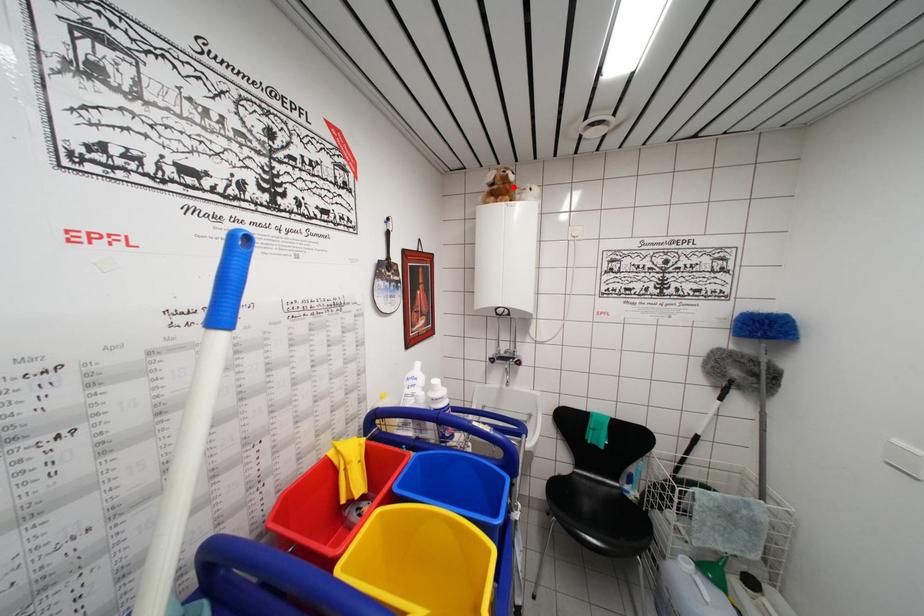
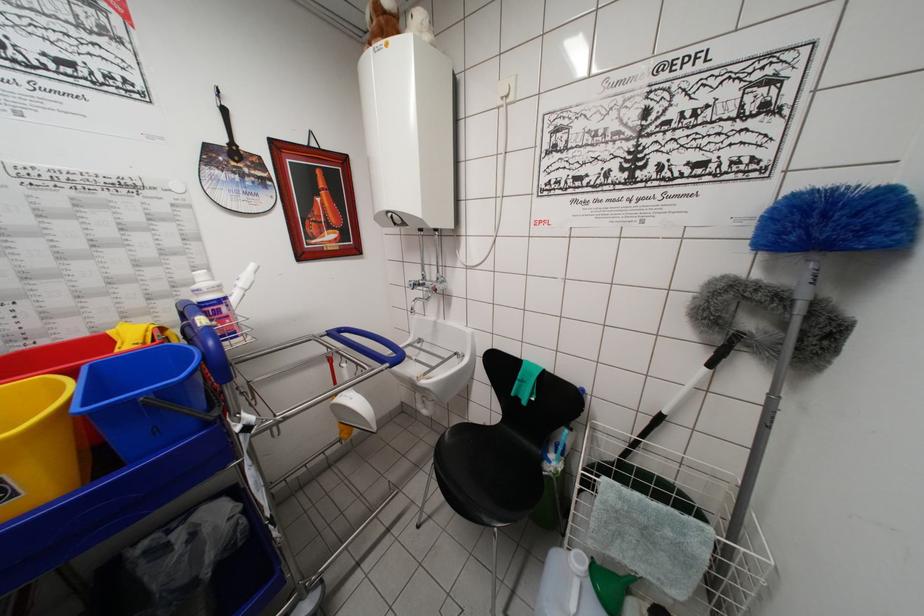
Locate, in the second image, the point that corresponds to the highlighted location in the first image.

(387, 17)